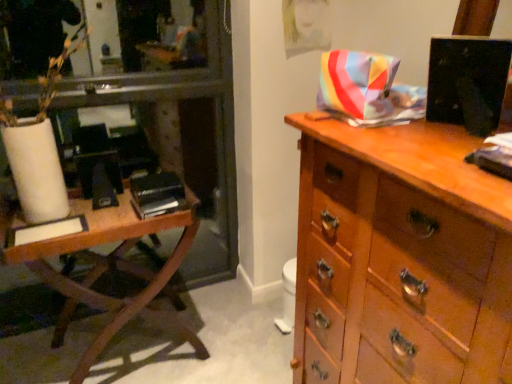
Find the location of a particular element. free location to the left of black glossy monitor at upper right is located at coordinates (396, 133).